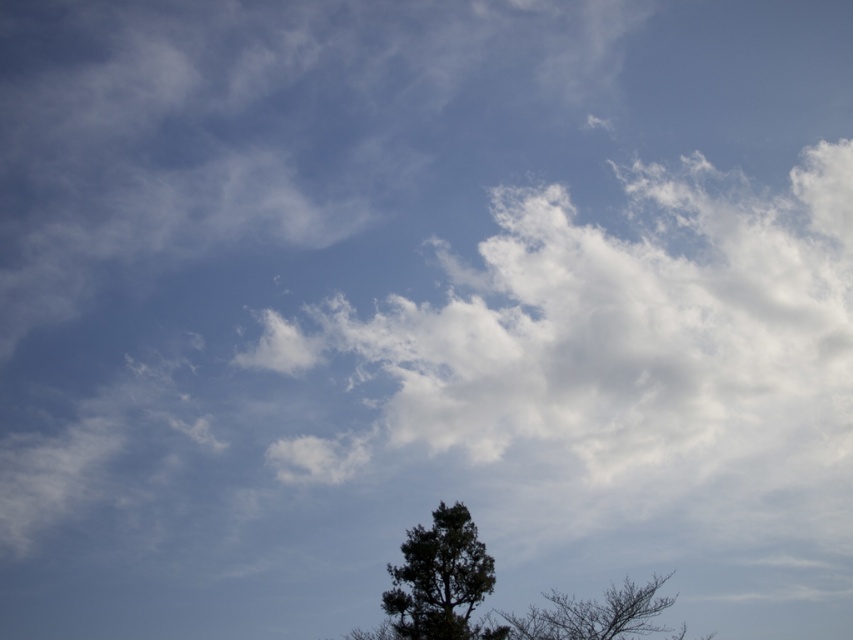
In the scene shown: You are a drone operator trying to capture a photo of the dark green textured tree at lower center. The drone is currently at point A located at coordinates 0.800, 0.400. You need to adjust the drone to the tree. Which direction should you move the drone to reach the tree?

The dark green textured tree at lower center is located at point (440, 579). The drone is at (340, 512). To reach the tree, move the drone east and north to increase both the x and y coordinates.

You are an artist trying to sketch the scene. You notice the dark green textured tree at lower center and the silhouette bark tree at lower right. Which tree is closer to the left edge of the image?

The dark green textured tree at lower center is positioned on the left side of silhouette bark tree at lower right, so it is closer to the left edge of the image.